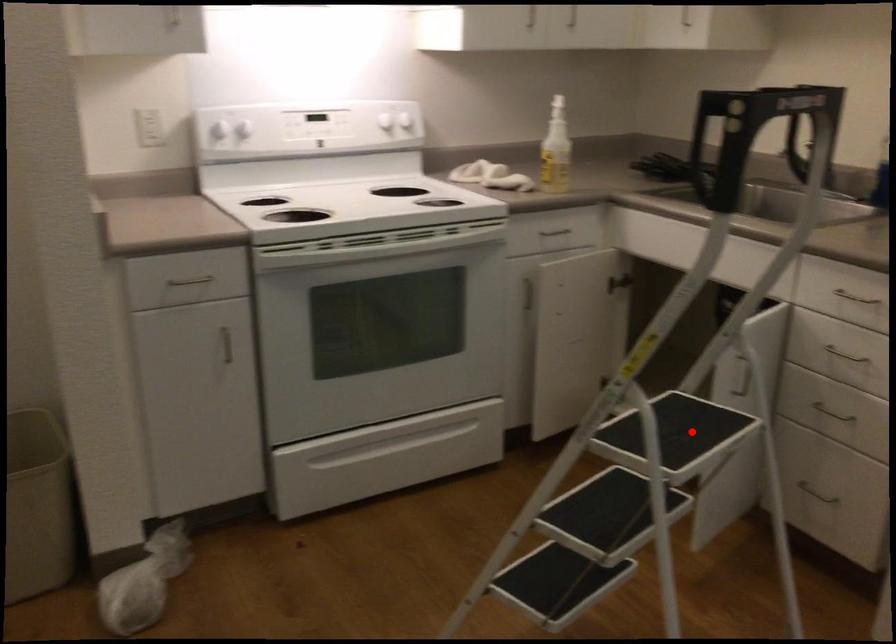
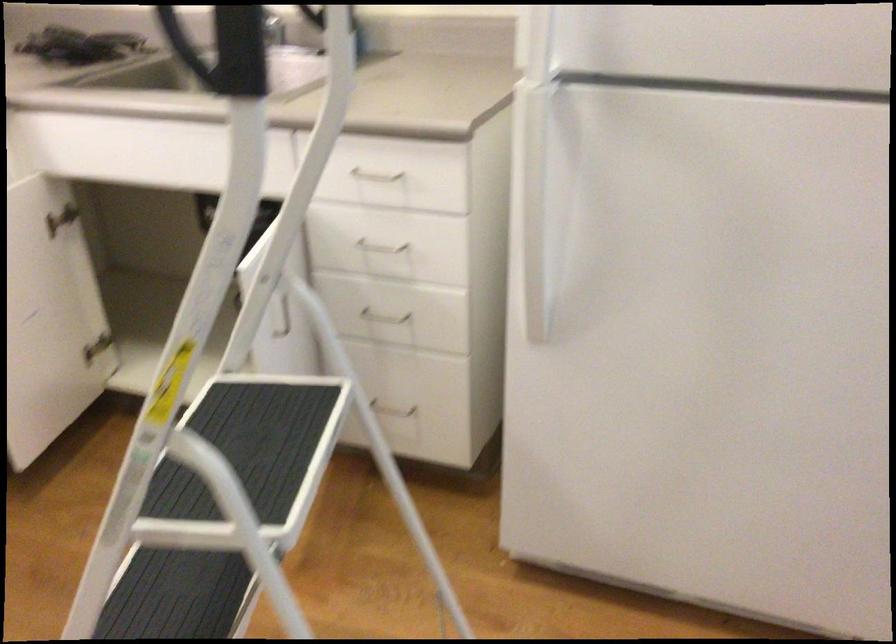
Question: I am providing you with two images of the same scene from different viewpoints. Given a red point in image1, look at the same physical point in image2. Is it:

Choices:
 (A) Closer to the viewpoint
 (B) Farther from the viewpoint

Answer: (A)